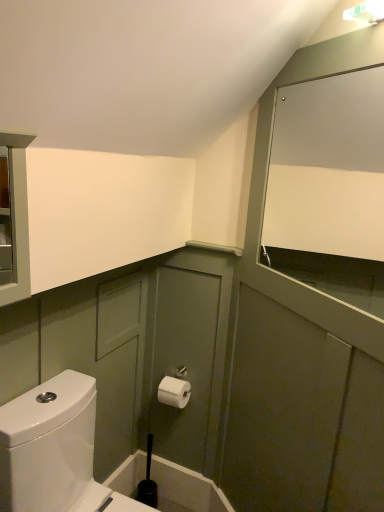
Find the location of a particular element. The width and height of the screenshot is (384, 512). white glossy toilet at lower left is located at coordinates (54, 450).

Describe the element at coordinates (174, 392) in the screenshot. I see `white paper toilet paper at center` at that location.

You are a GUI agent. You are given a task and a screenshot of the screen. Output one action in this format:
    pyautogui.click(x=<x>, y=<y>)
    Task: Click on the white matte cabinet at upper right
    
    Given the screenshot: What is the action you would take?
    pyautogui.click(x=330, y=186)

Looking at their sizes, would you say black plastic toilet brush at lower center is wider or thinner than white paper toilet paper at center?

Clearly, black plastic toilet brush at lower center has less width compared to white paper toilet paper at center.

Is black plastic toilet brush at lower center directly adjacent to white paper toilet paper at center?

No.

You are a GUI agent. You are given a task and a screenshot of the screen. Output one action in this format:
    pyautogui.click(x=<x>, y=<y>)
    Task: Click on the bath below the white paper toilet paper at center (from a real-world perspective)
    This screenshot has width=384, height=512.
    Given the screenshot: What is the action you would take?
    pyautogui.click(x=187, y=487)

Is black plastic toilet brush at lower center facing towards white paper toilet paper at center?

No, black plastic toilet brush at lower center is not oriented towards white paper toilet paper at center.

From a real-world perspective, is white paper toilet paper at center physically above white glossy toilet at lower left?

Correct, in the physical world, white paper toilet paper at center is higher than white glossy toilet at lower left.

Which object is positioned more to the left, white paper toilet paper at center or white glossy toilet at lower left?

From the viewer's perspective, white glossy toilet at lower left appears more on the left side.

Is white paper toilet paper at center oriented away from white glossy toilet at lower left?

No, white paper toilet paper at center is not facing the opposite direction of white glossy toilet at lower left.

How much distance is there between white paper toilet paper at center and white glossy toilet at lower left?

white paper toilet paper at center and white glossy toilet at lower left are 22.05 inches apart.

Find the location of a particular element. toiletry lying on the left of white matte cabinet at upper right is located at coordinates (174, 392).

Considering the sizes of white matte cabinet at upper right and white paper toilet paper at center in the image, is white matte cabinet at upper right taller or shorter than white paper toilet paper at center?

In the image, white matte cabinet at upper right appears to be taller than white paper toilet paper at center.

Is white matte cabinet at upper right facing away from white paper toilet paper at center?

white matte cabinet at upper right is not turned away from white paper toilet paper at center.

Is white glossy toilet at lower left positioned beyond the bounds of white matte cabinet at upper right?

white glossy toilet at lower left is positioned outside white matte cabinet at upper right.

Based on the photo, which is more to the left, white glossy toilet at lower left or white matte cabinet at upper right?

From the viewer's perspective, white glossy toilet at lower left appears more on the left side.

Considering the sizes of objects white glossy toilet at lower left and white matte cabinet at upper right in the image provided, who is bigger, white glossy toilet at lower left or white matte cabinet at upper right?

With larger size is white glossy toilet at lower left.

From the picture: Who is shorter, white glossy toilet at lower left or white matte cabinet at upper right?

Standing shorter between the two is white glossy toilet at lower left.

Is white glossy toilet at lower left spatially inside white paper toilet paper at center, or outside of it?

white glossy toilet at lower left is not inside white paper toilet paper at center, it's outside.

Is white paper toilet paper at center at the back of white glossy toilet at lower left?

No, white glossy toilet at lower left is not facing away from white paper toilet paper at center.

In terms of width, does white glossy toilet at lower left look wider or thinner when compared to white paper toilet paper at center?

Considering their sizes, white glossy toilet at lower left looks broader than white paper toilet paper at center.

Is white glossy toilet at lower left placed right next to white paper toilet paper at center?

They are not placed beside each other.

I want to click on mirror lying on the right of white glossy toilet at lower left, so [330, 186].

Can you confirm if white matte cabinet at upper right is positioned to the right of white glossy toilet at lower left?

Yes, white matte cabinet at upper right is to the right of white glossy toilet at lower left.

Is point (276, 234) positioned after point (74, 419)?

Yes.

Which of these two, white matte cabinet at upper right or white glossy toilet at lower left, is bigger?

Bigger between the two is white glossy toilet at lower left.

Can you confirm if white glossy toilet at lower left is positioned to the left of black plastic toilet brush at lower center?

Correct, you'll find white glossy toilet at lower left to the left of black plastic toilet brush at lower center.

Considering their positions, is white glossy toilet at lower left located in front of or behind black plastic toilet brush at lower center?

white glossy toilet at lower left is positioned closer to the viewer than black plastic toilet brush at lower center.

Looking at this image, based on their sizes in the image, would you say white glossy toilet at lower left is bigger or smaller than black plastic toilet brush at lower center?

In the image, white glossy toilet at lower left appears to be larger than black plastic toilet brush at lower center.

Does white glossy toilet at lower left contain black plastic toilet brush at lower center?

Definitely not — black plastic toilet brush at lower center is not inside white glossy toilet at lower left.

The width and height of the screenshot is (384, 512). What are the coordinates of `toiletry above the black plastic toilet brush at lower center (from a real-world perspective)` in the screenshot? It's located at (174, 392).

Find the location of a particular element. Image resolution: width=384 pixels, height=512 pixels. toiletry above the white glossy toilet at lower left (from the image's perspective) is located at coordinates (174, 392).

Looking at the image, which one is located further to white paper toilet paper at center, white glossy toilet at lower left or black plastic toilet brush at lower center?

Based on the image, white glossy toilet at lower left appears to be further to white paper toilet paper at center.

Looking at the image, which one is located closer to white matte cabinet at upper right, white glossy toilet at lower left or black plastic toilet brush at lower center?

white glossy toilet at lower left lies closer to white matte cabinet at upper right than the other object.

Estimate the real-world distances between objects in this image. Which object is further from white paper toilet paper at center, white matte cabinet at upper right or black plastic toilet brush at lower center?

Based on the image, white matte cabinet at upper right appears to be further to white paper toilet paper at center.

From the image, which object appears to be nearer to white glossy toilet at lower left, black plastic toilet brush at lower center or white paper toilet paper at center?

white paper toilet paper at center.

From the image, which object appears to be nearer to white matte cabinet at upper right, black plastic toilet brush at lower center or white glossy toilet at lower left?

The object closer to white matte cabinet at upper right is white glossy toilet at lower left.

When comparing their distances from black plastic toilet brush at lower center, does white glossy toilet at lower left or white matte cabinet at upper right seem further?

white matte cabinet at upper right lies further to black plastic toilet brush at lower center than the other object.

Considering their positions, is white glossy toilet at lower left positioned further to white matte cabinet at upper right than white paper toilet paper at center?

white glossy toilet at lower left is positioned further to the anchor white matte cabinet at upper right.

From the image, which object appears to be nearer to white glossy toilet at lower left, white paper toilet paper at center or black plastic toilet brush at lower center?

Based on the image, white paper toilet paper at center appears to be nearer to white glossy toilet at lower left.

You are a GUI agent. You are given a task and a screenshot of the screen. Output one action in this format:
    pyautogui.click(x=<x>, y=<y>)
    Task: Click on the toilet between white matte cabinet at upper right and white paper toilet paper at center from front to back
    
    Given the screenshot: What is the action you would take?
    pyautogui.click(x=54, y=450)

You are a GUI agent. You are given a task and a screenshot of the screen. Output one action in this format:
    pyautogui.click(x=<x>, y=<y>)
    Task: Click on the toiletry positioned between white glossy toilet at lower left and black plastic toilet brush at lower center from near to far
    This screenshot has height=512, width=384.
    Given the screenshot: What is the action you would take?
    [x=174, y=392]

Where is `toiletry between white matte cabinet at upper right and black plastic toilet brush at lower center vertically`? toiletry between white matte cabinet at upper right and black plastic toilet brush at lower center vertically is located at coordinates (174, 392).

I want to click on toilet between white matte cabinet at upper right and black plastic toilet brush at lower center in the vertical direction, so coord(54,450).